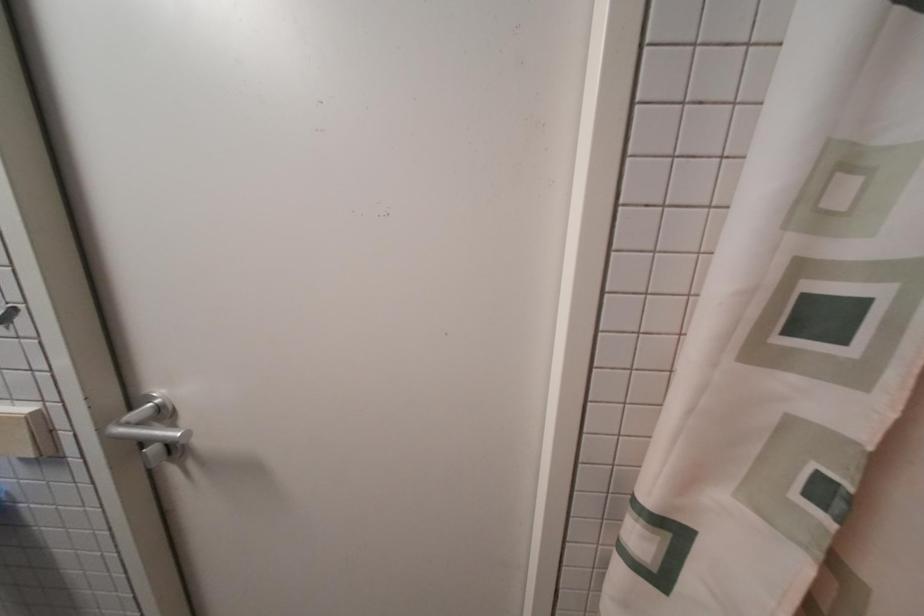
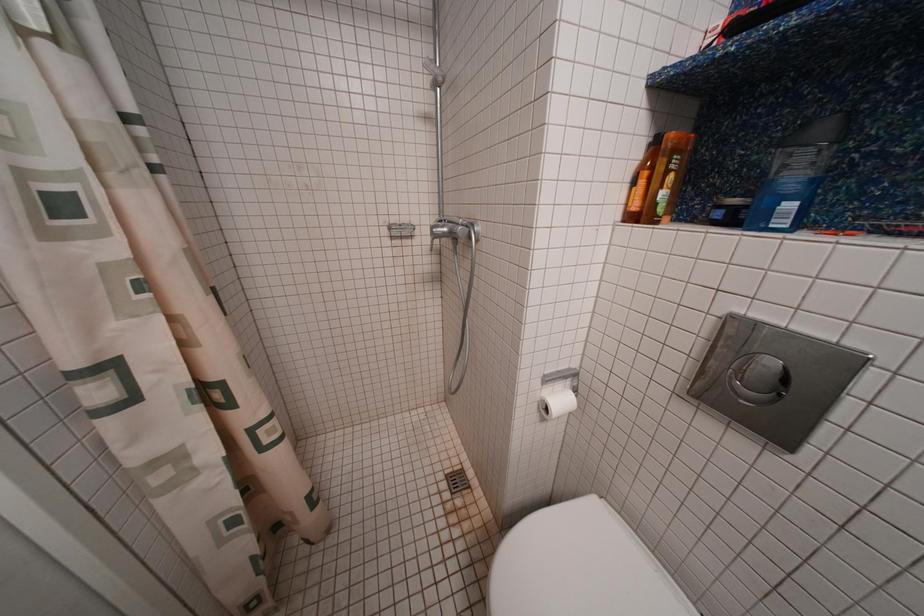
The first image is from the beginning of the video and the second image is from the end. How did the camera likely rotate when shooting the video?

The camera rotated toward right-down.